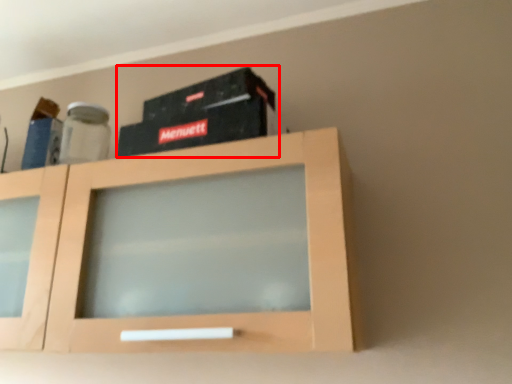
Question: From the image's perspective, what is the correct spatial relationship of box (annotated by the red box) in relation to cabinetry?

Choices:
 (A) above
 (B) below

Answer: (A)